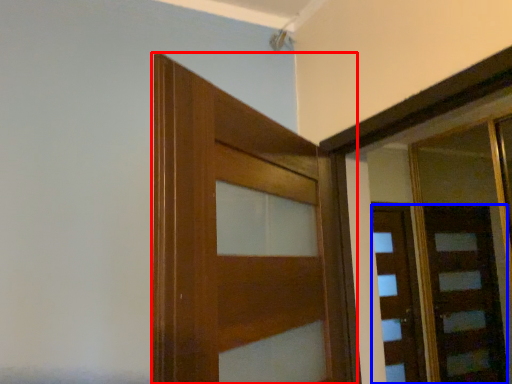
Question: Which object appears closest to the camera in this image, door (highlighted by a red box) or door (highlighted by a blue box)?

Choices:
 (A) door
 (B) door

Answer: (A)